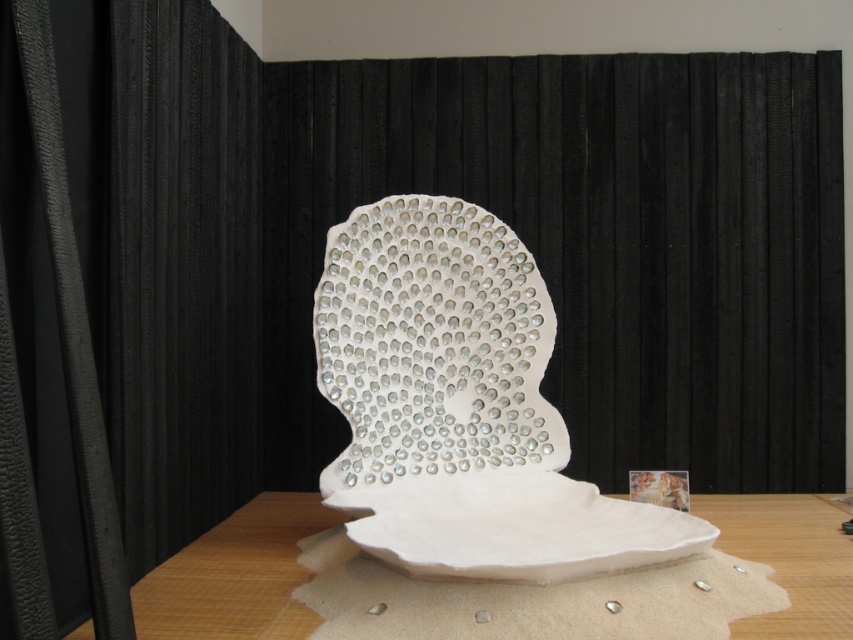
Please provide the coordinates of the white glossy shell at center in the image.

The white glossy shell at center is located at coordinates point (460, 406).

What is the significance of the point marked at coordinates (460, 406) in the image?

The point marked at coordinates (460, 406) indicates the location of the white glossy shell at center in the image.

Please provide the coordinates of the white glossy shell at center in the image.

The white glossy shell at center is located at coordinates point (460, 406).